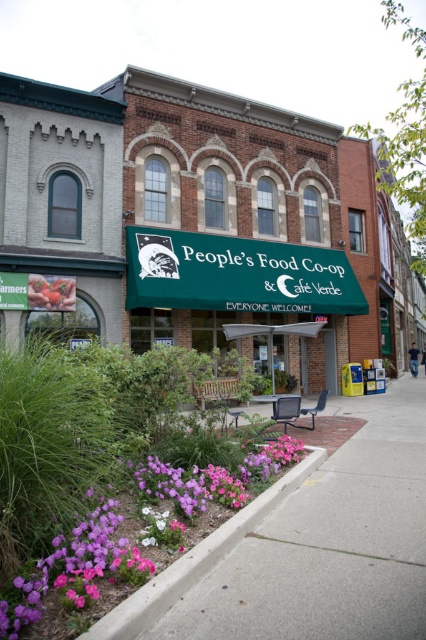
Is paved concrete sidewalk at lower center below concrete at lower center?

Yes.

Describe the element at coordinates (331, 544) in the screenshot. The image size is (426, 640). I see `paved concrete sidewalk at lower center` at that location.

Find the location of `paved concrete sidewalk at lower center`. paved concrete sidewalk at lower center is located at coordinates (331, 544).